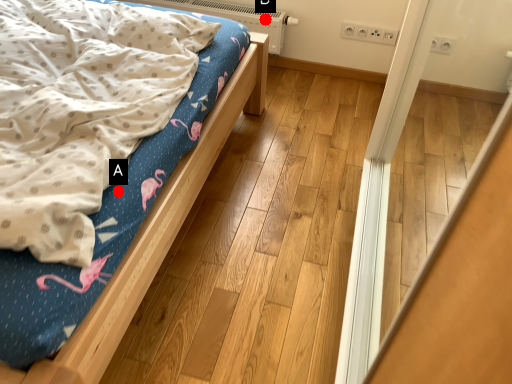
Question: Two points are circled on the image, labeled by A and B beside each circle. Which of the following is the closest to the observer?

Choices:
 (A) A is closer
 (B) B is closer

Answer: (A)